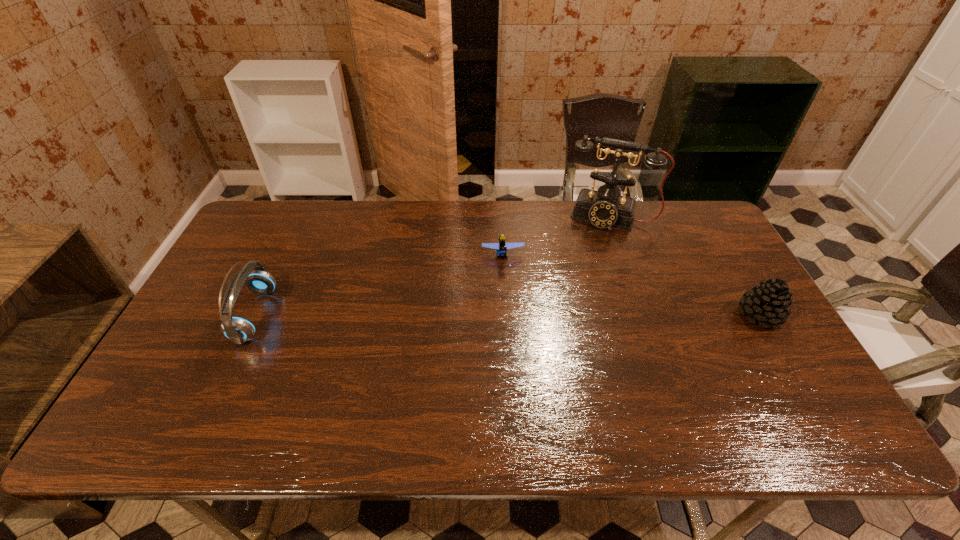
The width and height of the screenshot is (960, 540). What are the coordinates of `vacant space located 0.380m on the front-facing side of the second object from left to right` in the screenshot? It's located at (513, 372).

Identify the location of vacant space situated on the front-facing side of the second object from left to right. The image size is (960, 540). (512, 352).

Identify the location of free region located 0.230m on the dial of the farthest object. (584, 276).

At what (x,y) coordinates should I click in order to perform the action: click on free space located on the dial of the farthest object. Please return your answer as a coordinate pair (x, y). This screenshot has width=960, height=540. Looking at the image, I should click on (581, 285).

Find the location of a particular element. vacant region located 0.170m on the dial of the farthest object is located at coordinates (588, 264).

Where is `Lego positioned at the far edge`? This screenshot has width=960, height=540. Lego positioned at the far edge is located at coordinates (501, 247).

Locate an element on the screen. The width and height of the screenshot is (960, 540). telephone that is positioned at the far edge is located at coordinates (604, 208).

Where is `object at the left edge`? This screenshot has height=540, width=960. object at the left edge is located at coordinates (238, 329).

Identify the location of object at the right edge. The image size is (960, 540). (768, 303).

This screenshot has width=960, height=540. I want to click on free space at the far edge, so click(322, 224).